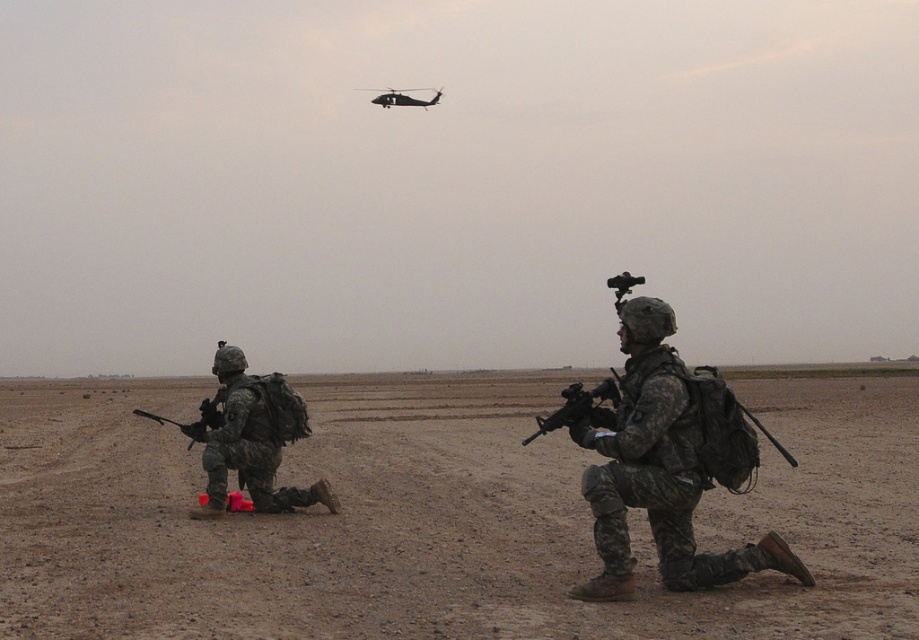
Question: Does matte black rifle at center have a greater width compared to matte black rifle at left?

Choices:
 (A) no
 (B) yes

Answer: (A)

Question: Does camouflage fabric uniform at left appear over black matte helicopter at upper center?

Choices:
 (A) no
 (B) yes

Answer: (A)

Question: Which point appears closest to the camera in this image?

Choices:
 (A) (546, 419)
 (B) (447, 444)
 (C) (182, 428)
 (D) (271, 451)

Answer: (A)

Question: Does camouflage fabric uniform at left appear on the right side of matte black rifle at center?

Choices:
 (A) no
 (B) yes

Answer: (A)

Question: Among these points, which one is farthest from the camera?

Choices:
 (A) (581, 385)
 (B) (734, 588)

Answer: (A)

Question: Based on their relative distances, which object is nearer to the dull brown dirt at center?

Choices:
 (A) matte black rifle at left
 (B) matte black rifle at center

Answer: (B)